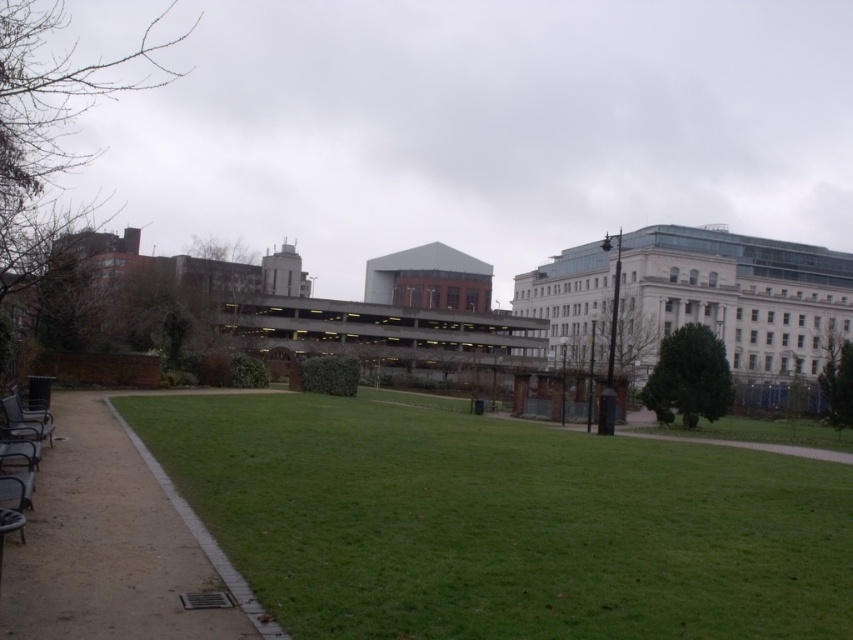
In the scene shown: You are standing in the park and want to walk from point A to point B. Point A is at coordinate point (676,452) and point B is at coordinate point (44,426). Which point is closer to you when you start walking?

Point B at coordinate point (44,426) is closer to you because it is nearer to the camera position compared to point A at coordinate point (676,452), which is further away.

You are planning to place a picnic blanket in the park. The blanket is 2 meters wide. You see the green grass at center and the brown gravel path at lower left. Which area can accommodate the blanket without folding it?

The green grass at center is larger in size than the brown gravel path at lower left, so the picnic blanket can be placed on the green grass at center without folding since it has more space.